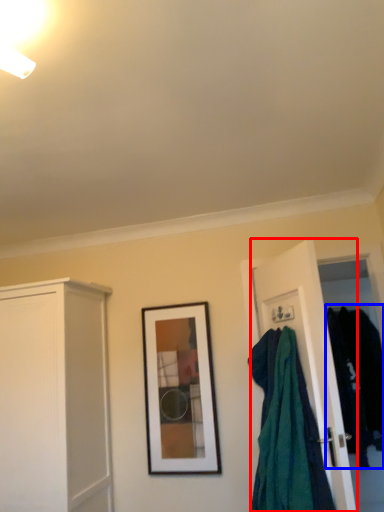
Question: Which object appears farthest to the camera in this image, door (highlighted by a red box) or clothing (highlighted by a blue box)?

Choices:
 (A) door
 (B) clothing

Answer: (B)